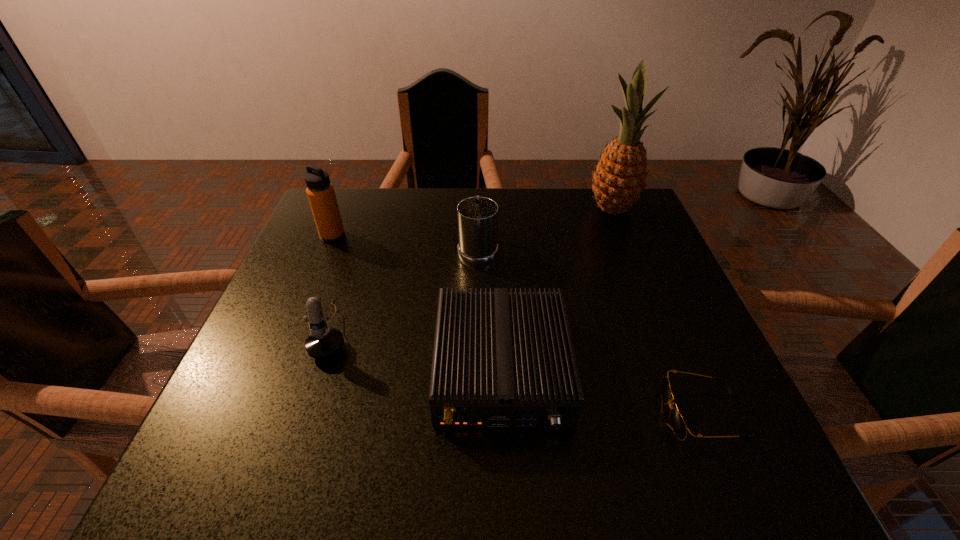
Find the location of a particular element. The width and height of the screenshot is (960, 540). vacant area that lies between the fifth tallest object and the fifth object from right to left is located at coordinates (418, 350).

This screenshot has height=540, width=960. Identify the location of vacant space in between the router and the shortest object. (602, 392).

Find the location of a particular element. The width and height of the screenshot is (960, 540). free space between the tallest object and the microphone is located at coordinates (473, 269).

You are a GUI agent. You are given a task and a screenshot of the screen. Output one action in this format:
    pyautogui.click(x=<x>, y=<y>)
    Task: Click on the free space that is in between the leftmost object and the fifth tallest object
    This screenshot has width=960, height=540.
    Given the screenshot: What is the action you would take?
    pyautogui.click(x=417, y=303)

The width and height of the screenshot is (960, 540). What are the coordinates of `free point between the second object from left to right and the leftmost object` in the screenshot? It's located at (333, 283).

Identify which object is located as the third nearest to the sunglasses. Please provide its 2D coordinates. Your answer should be formatted as a tuple, i.e. [(x, y)], where the tuple contains the x and y coordinates of a point satisfying the conditions above.

[(619, 179)]

You are a GUI agent. You are given a task and a screenshot of the screen. Output one action in this format:
    pyautogui.click(x=<x>, y=<y>)
    Task: Click on the second closest object to the second shortest object
    The image size is (960, 540).
    Given the screenshot: What is the action you would take?
    pyautogui.click(x=678, y=424)

At what (x,y) coordinates should I click in order to perform the action: click on free space that satisfies the following two spatial constraints: 1. on the back side of the fifth shortest object; 2. on the right side of the pineapple. Please return your answer as a coordinate pair (x, y). Looking at the image, I should click on (344, 208).